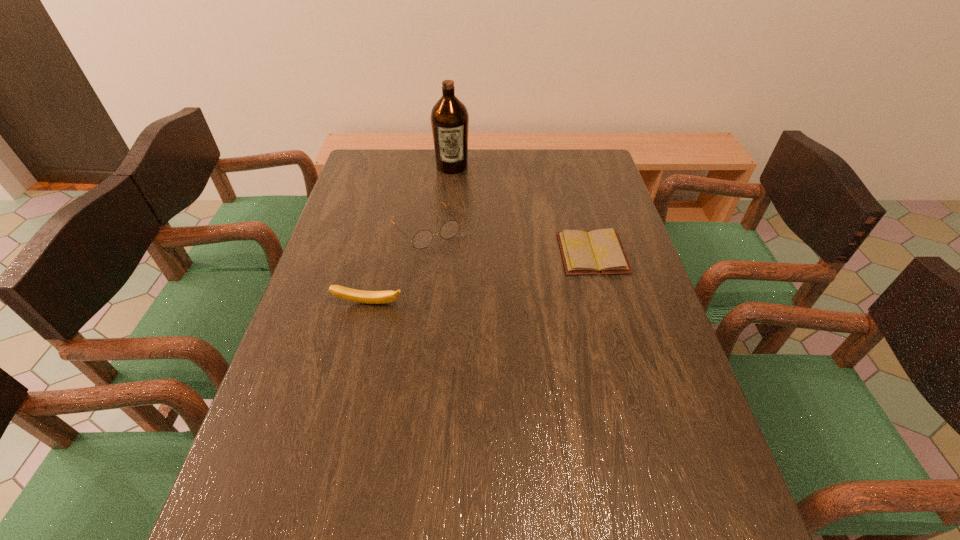
Find the location of `free space at the far left corner`. free space at the far left corner is located at coordinates (393, 178).

You are a GUI agent. You are given a task and a screenshot of the screen. Output one action in this format:
    pyautogui.click(x=<x>, y=<y>)
    Task: Click on the vacant space at the near left corner
    The width and height of the screenshot is (960, 540).
    Given the screenshot: What is the action you would take?
    pyautogui.click(x=273, y=476)

Image resolution: width=960 pixels, height=540 pixels. Find the location of `vacant space at the far right corner of the desktop`. vacant space at the far right corner of the desktop is located at coordinates (588, 148).

You are a GUI agent. You are given a task and a screenshot of the screen. Output one action in this format:
    pyautogui.click(x=<x>, y=<y>)
    Task: Click on the free spot at the near right corner of the desktop
    Image resolution: width=960 pixels, height=540 pixels.
    Given the screenshot: What is the action you would take?
    pyautogui.click(x=717, y=477)

The height and width of the screenshot is (540, 960). Find the location of `free space between the nearest object and the olive oil`. free space between the nearest object and the olive oil is located at coordinates (411, 235).

Where is `vacant space in between the banana and the spectacles`? vacant space in between the banana and the spectacles is located at coordinates (396, 266).

The image size is (960, 540). What are the coordinates of `free spot between the spectacles and the nearest object` in the screenshot? It's located at (396, 266).

Identify the location of vacant area that lies between the nearest object and the farthest object. This screenshot has width=960, height=540. (411, 235).

Identify the location of free space between the tallest object and the spectacles. (438, 198).

Locate an element on the screen. The width and height of the screenshot is (960, 540). vacant area between the shortest object and the olive oil is located at coordinates pos(522,210).